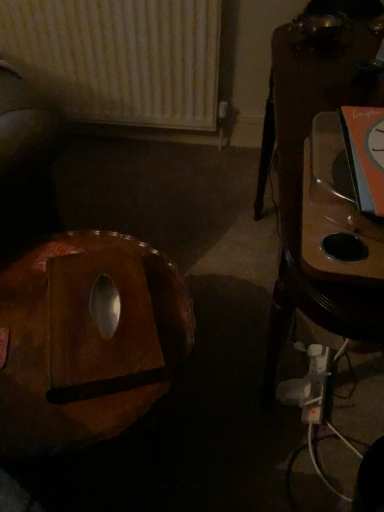
Identify the location of free spot above brown leather bean bag chair at lower left (from a real-world perspective). This screenshot has height=512, width=384. (93, 318).